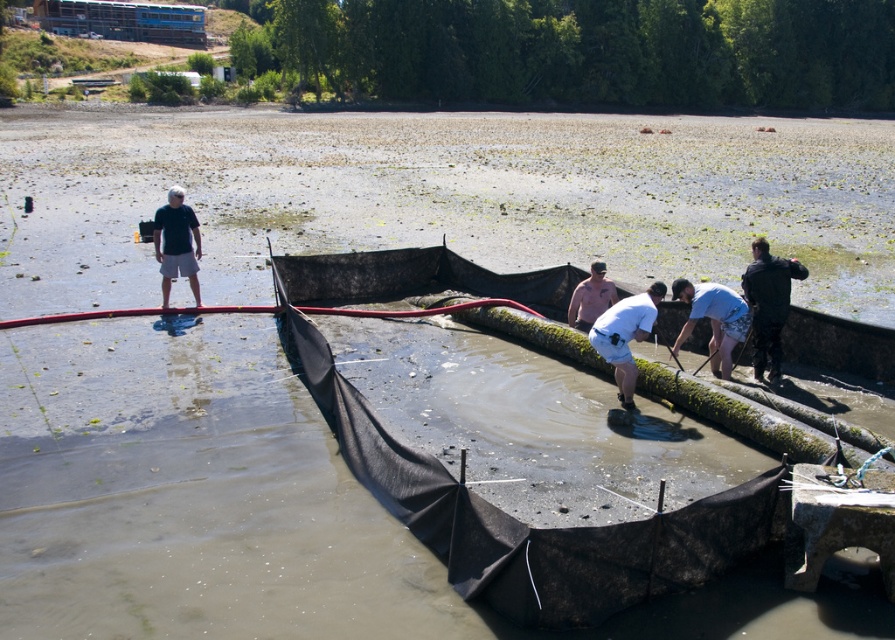
Question: Which point is farther from the camera taking this photo?

Choices:
 (A) (727, 353)
 (B) (177, 195)

Answer: (B)

Question: Is dark matte wetsuit at right below matte black shirt at left?

Choices:
 (A) yes
 (B) no

Answer: (A)

Question: Which object is the closest to the pink matte shirt at center?

Choices:
 (A) white matte shorts at center
 (B) white matte shirt at lower right

Answer: (B)

Question: Where is dark matte wetsuit at right located in relation to pink matte shirt at center in the image?

Choices:
 (A) right
 (B) left

Answer: (A)

Question: Estimate the real-world distances between objects in this image. Which object is farther from the white matte shirt at lower right?

Choices:
 (A) matte black shirt at left
 (B) white matte shorts at center
 (C) pink matte shirt at center

Answer: (A)

Question: Can you confirm if dark matte wetsuit at right is bigger than white matte shorts at center?

Choices:
 (A) no
 (B) yes

Answer: (A)